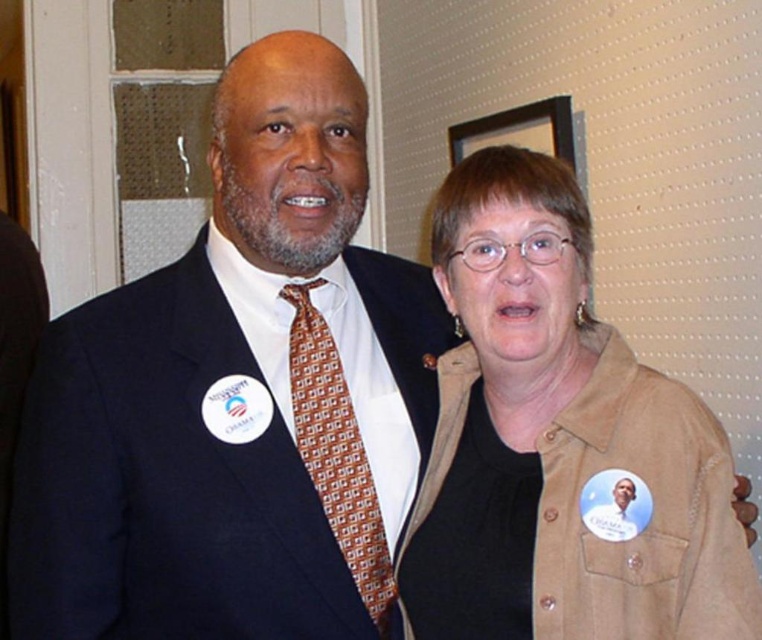
Question: Is brown suede jacket at center positioned before brown silk tie at center?

Choices:
 (A) no
 (B) yes

Answer: (B)

Question: Which point appears closest to the camera in this image?

Choices:
 (A) (740, 627)
 (B) (317, 323)

Answer: (A)

Question: Which point is closer to the camera?

Choices:
 (A) (552, 422)
 (B) (296, 374)

Answer: (A)

Question: Which point is farther from the camera taking this photo?

Choices:
 (A) (315, 349)
 (B) (546, 518)

Answer: (A)

Question: From the image, what is the correct spatial relationship of brown suede jacket at center in relation to brown silk tie at center?

Choices:
 (A) left
 (B) right

Answer: (B)

Question: Is brown suede jacket at center bigger than brown silk tie at center?

Choices:
 (A) yes
 (B) no

Answer: (A)